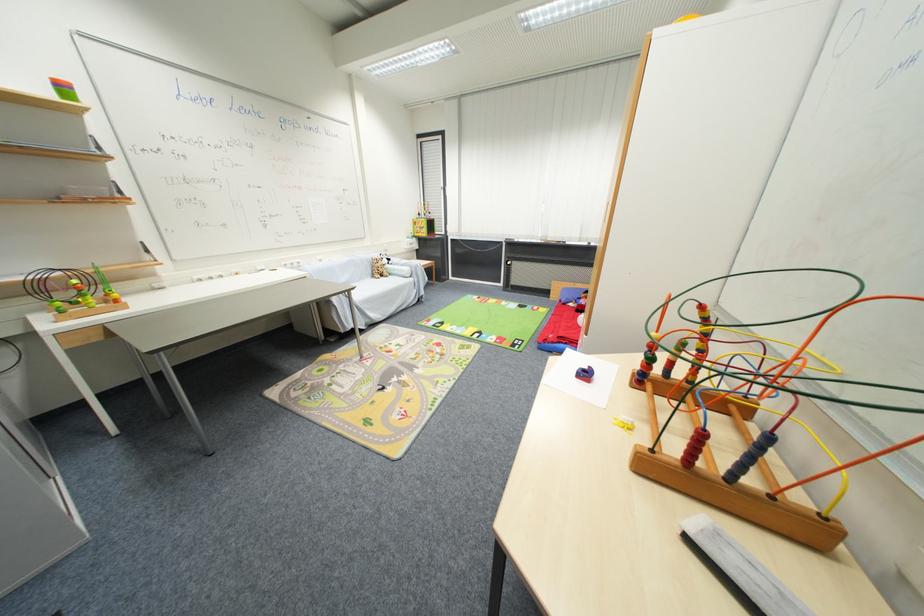
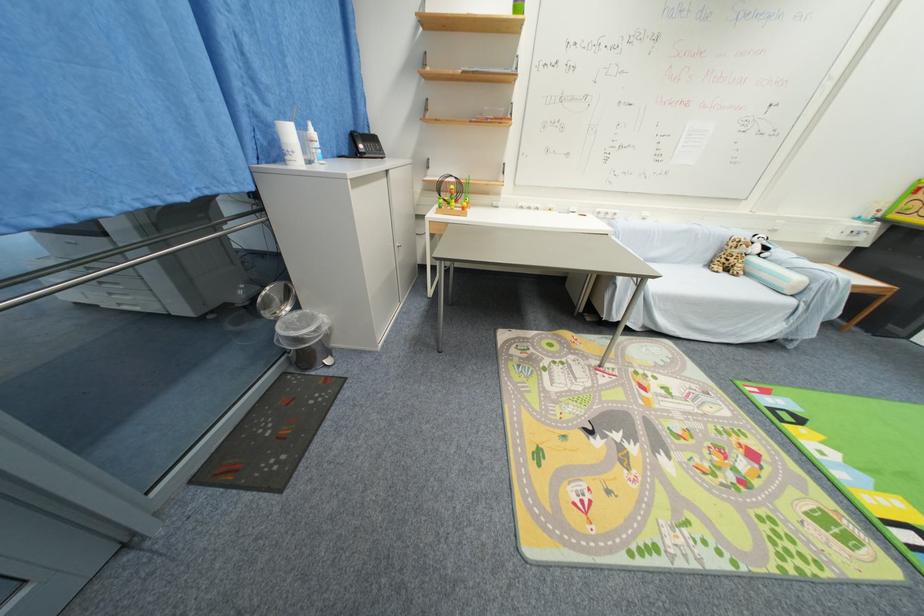
Question: I am providing you with two images of the same scene from different viewpoints. Please identify which objects are invisible in image2.

Choices:
 (A) trash can lid
 (B) white pump bottle
 (C) panda stuffed animal
 (D) none of these

Answer: (D)